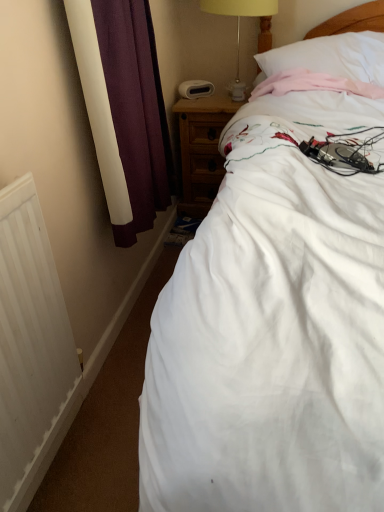
You are a GUI agent. You are given a task and a screenshot of the screen. Output one action in this format:
    pyautogui.click(x=<x>, y=<y>)
    Task: Click on the empty space that is ontop of wooden nightstand at upper right (from a real-world perspective)
    This screenshot has height=512, width=384.
    Given the screenshot: What is the action you would take?
    pyautogui.click(x=209, y=96)